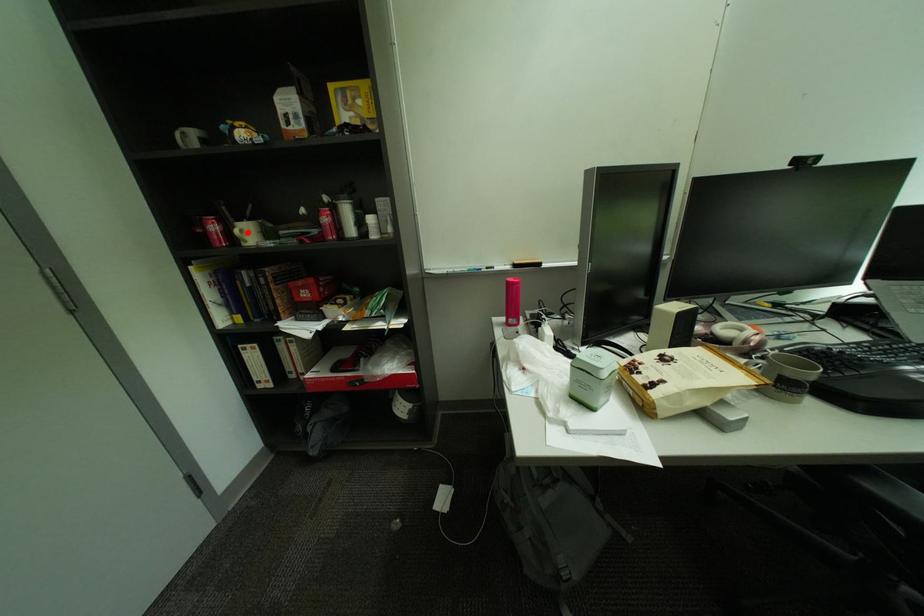
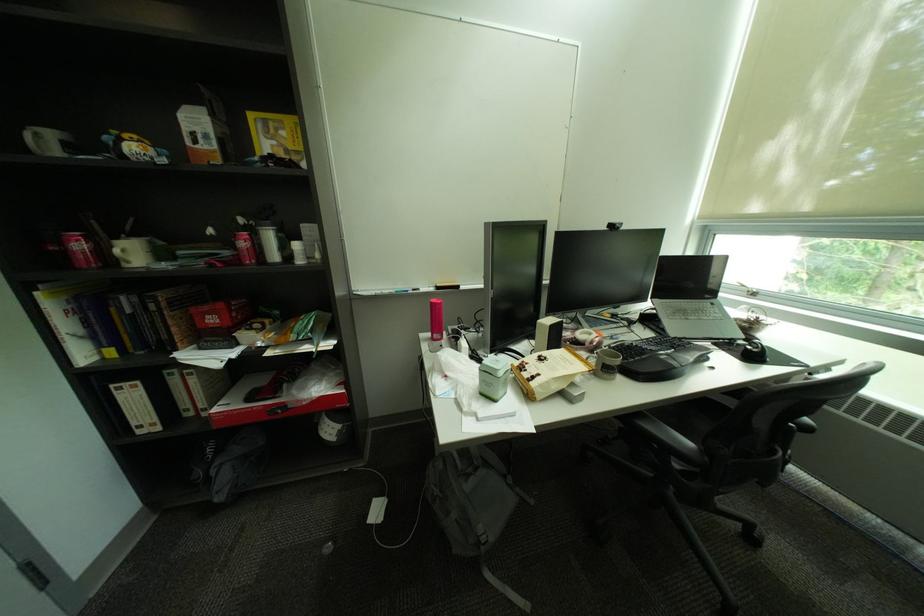
The point at the highlighted location is marked in the first image. Where is the corresponding point in the second image?

(128, 252)